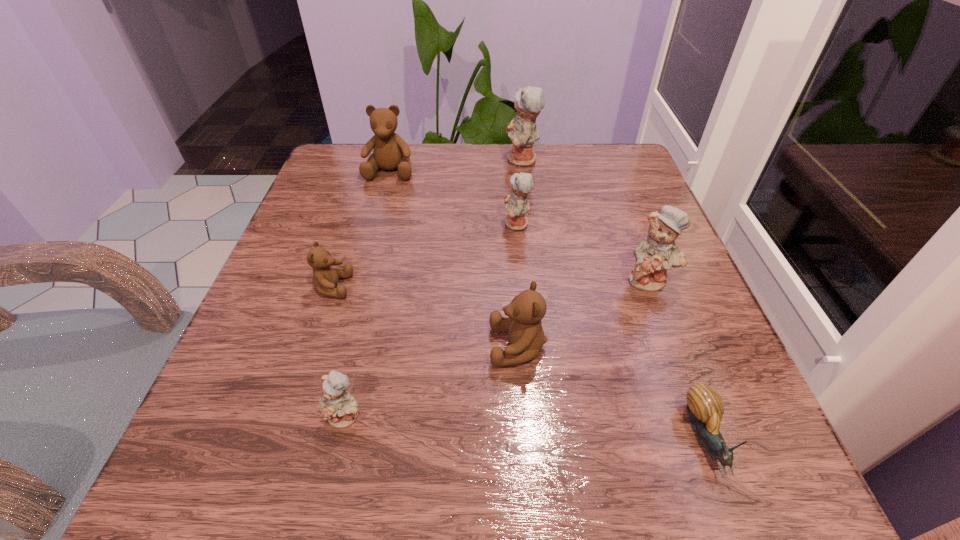
Identify the location of the smallest blue teddy bear. This screenshot has height=540, width=960. [339, 407].

Identify the location of the smallest brown teddy bear. click(325, 278).

You are a GUI agent. You are given a task and a screenshot of the screen. Output one action in this format:
    pyautogui.click(x=<x>, y=<y>)
    Task: Click on the shortest object
    This screenshot has height=540, width=960.
    Given the screenshot: What is the action you would take?
    pyautogui.click(x=705, y=407)

Where is `vacant region located on the front-facing side of the farthest blue teddy bear`? vacant region located on the front-facing side of the farthest blue teddy bear is located at coordinates (407, 160).

Image resolution: width=960 pixels, height=540 pixels. Identify the location of vacant space located on the front-facing side of the farthest blue teddy bear. (440, 160).

Where is `free space located on the front-facing side of the farthest blue teddy bear`? The height and width of the screenshot is (540, 960). free space located on the front-facing side of the farthest blue teddy bear is located at coordinates (420, 160).

The width and height of the screenshot is (960, 540). What are the coordinates of `vacant space located on the front-facing side of the farthest brown teddy bear` in the screenshot? It's located at click(375, 224).

At what (x,y) coordinates should I click in order to perform the action: click on vacant area situated 0.070m on the front-facing side of the rightmost teddy bear. Please return your answer as a coordinate pair (x, y). The image size is (960, 540). Looking at the image, I should click on (667, 326).

Where is `free spot located on the front-facing side of the third biggest blue teddy bear`? free spot located on the front-facing side of the third biggest blue teddy bear is located at coordinates (473, 224).

Locate an element on the screen. vacant space located 0.220m on the front-facing side of the third biggest blue teddy bear is located at coordinates (396, 224).